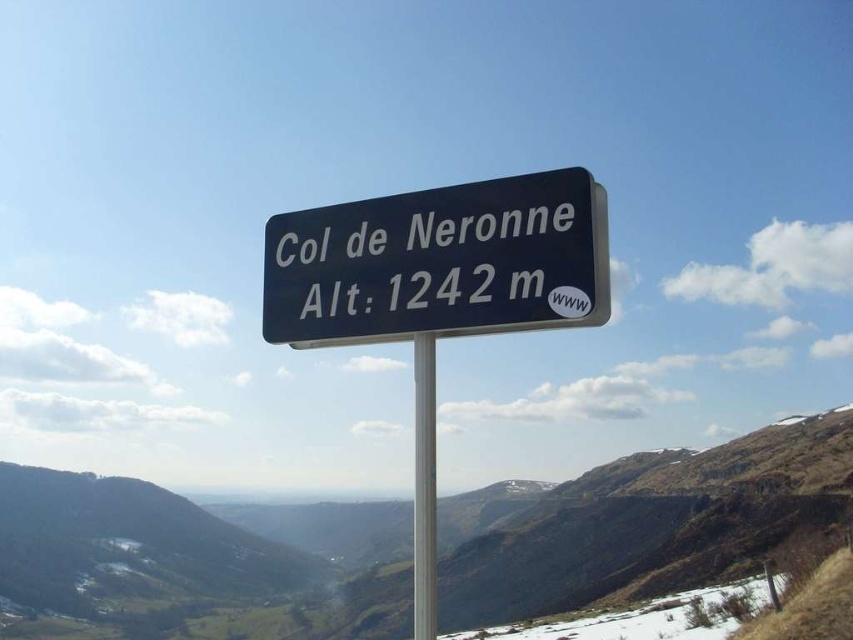
You are standing in front of the signpost and want to take a photo of the silver metallic pole at center and the green grassy mountain at center. Which object should you focus on first if you want both to be in clear focus?

You should focus on the silver metallic pole at center first because it is closer to you than the green grassy mountain at center, ensuring both are in focus with proper depth of field.

You are standing in front of a signpost at Col de Neronne. You notice the black plastic sign at center and the silver metallic pole at center. Which object is closer to you?

The black plastic sign at center is closer to you because it is in front of the silver metallic pole at center.